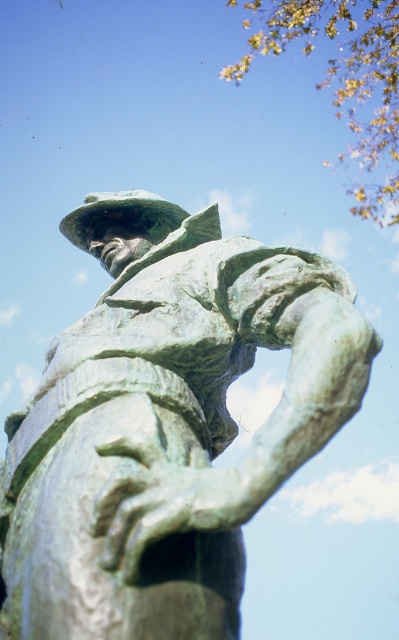
You are an art conservator examining the statue. You notice both the green patina statue at center and the green patina hat at center. Which object is closer to you?

The green patina statue at center is closer to you because it is in front of the green patina hat at center.